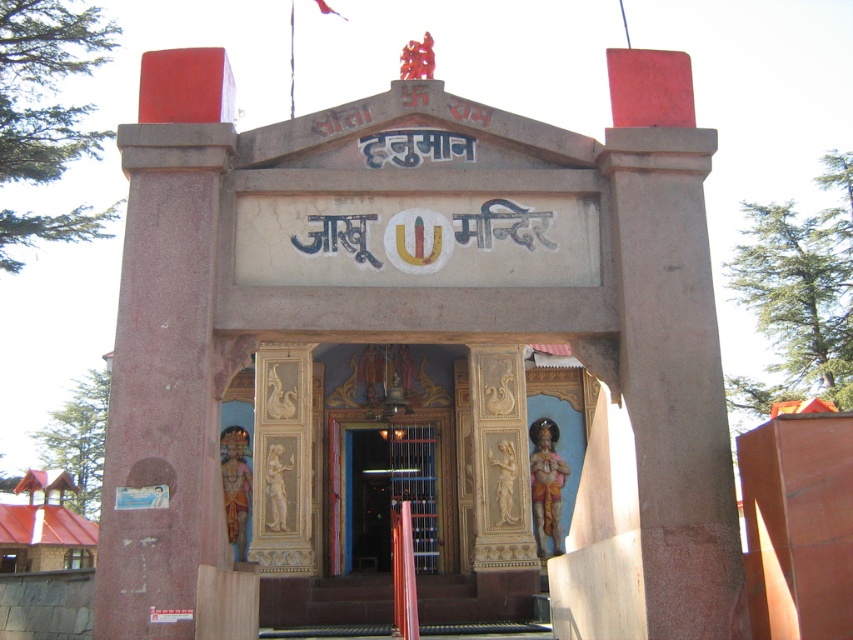
Question: Is smooth stone hindu temple at center above smooth stone stairs at center?

Choices:
 (A) yes
 (B) no

Answer: (A)

Question: Can you confirm if smooth stone stairs at center is positioned below wooden door at center?

Choices:
 (A) no
 (B) yes

Answer: (B)

Question: Estimate the real-world distances between objects in this image. Which object is farther from the wooden door at center?

Choices:
 (A) smooth stone stairs at center
 (B) smooth stone hindu temple at center

Answer: (B)

Question: Can you confirm if smooth stone hindu temple at center is bigger than smooth stone stairs at center?

Choices:
 (A) yes
 (B) no

Answer: (A)

Question: Which object appears closest to the camera in this image?

Choices:
 (A) smooth stone stairs at center
 (B) smooth stone hindu temple at center

Answer: (B)

Question: Which object is farther from the camera taking this photo?

Choices:
 (A) wooden door at center
 (B) smooth stone hindu temple at center

Answer: (A)